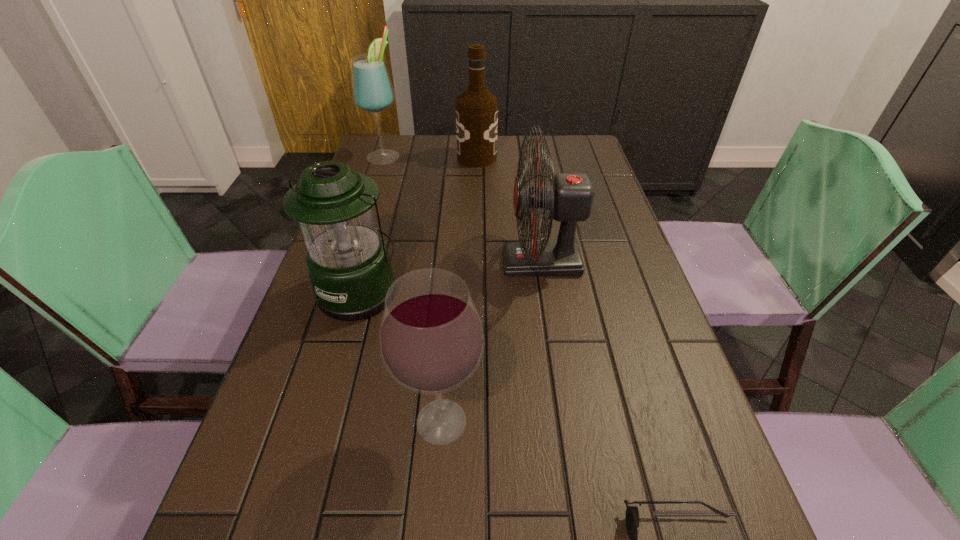
Where is `alcohol at the left edge`? The height and width of the screenshot is (540, 960). alcohol at the left edge is located at coordinates (372, 91).

Locate an element on the screen. The image size is (960, 540). lantern situated at the left edge is located at coordinates (348, 263).

This screenshot has height=540, width=960. Identify the location of object that is at the right edge. (569, 197).

At what (x,y) coordinates should I click in order to perform the action: click on object that is at the far left corner. Please return your answer as a coordinate pair (x, y). The height and width of the screenshot is (540, 960). Looking at the image, I should click on (372, 91).

This screenshot has height=540, width=960. In the image, there is a desktop. Find the location of `vacant space at the far edge`. vacant space at the far edge is located at coordinates tap(426, 142).

Locate an element on the screen. free space at the left edge of the desktop is located at coordinates (294, 345).

Where is `vacant position at the right edge of the desktop`? The image size is (960, 540). vacant position at the right edge of the desktop is located at coordinates (642, 429).

This screenshot has height=540, width=960. What are the coordinates of `unoccupied position between the fan and the leftmost alcohol` in the screenshot? It's located at (463, 209).

Locate an element on the screen. This screenshot has width=960, height=540. vacant area that lies between the leftmost alcohol and the fan is located at coordinates click(x=463, y=209).

Find the location of a particular element. This screenshot has height=540, width=960. object that ranks as the fourth closest to the lantern is located at coordinates (476, 108).